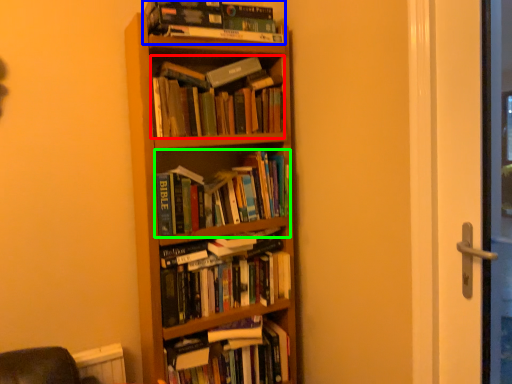
Question: Estimate the real-world distances between objects in this image. Which object is farther from book (highlighted by a red box), book (highlighted by a blue box) or book (highlighted by a green box)?

Choices:
 (A) book
 (B) book

Answer: (B)